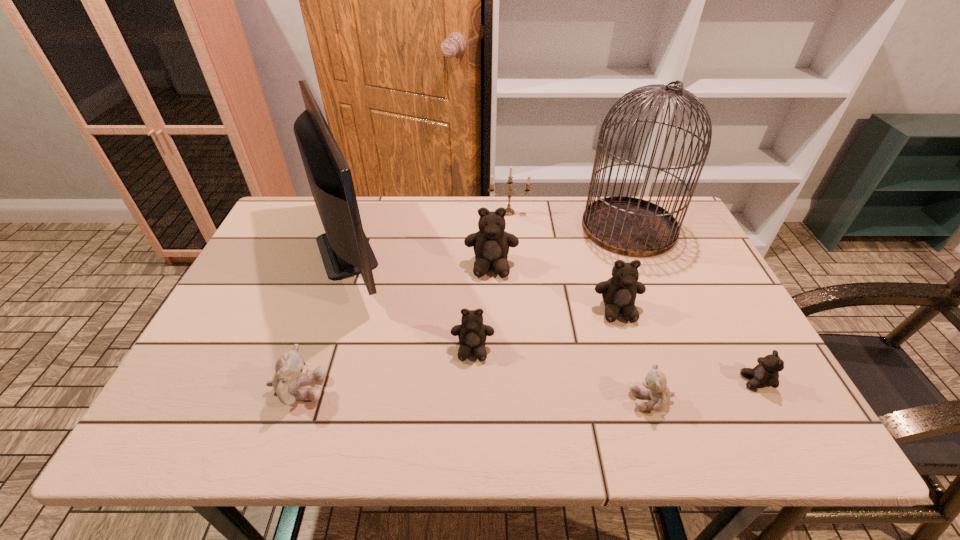
Where is `birdcage`? This screenshot has width=960, height=540. birdcage is located at coordinates (629, 226).

I want to click on computer monitor, so click(345, 250).

The image size is (960, 540). In order to click on the farthest brown teddy bear in this screenshot , I will do `click(491, 243)`.

You are a GUI agent. You are given a task and a screenshot of the screen. Output one action in this format:
    pyautogui.click(x=<x>, y=<y>)
    Task: Click on the tallest teddy bear
    
    Given the screenshot: What is the action you would take?
    pyautogui.click(x=491, y=243)

Image resolution: width=960 pixels, height=540 pixels. Identify the location of candle. (510, 211).

Image resolution: width=960 pixels, height=540 pixels. Identify the location of the second biggest brown teddy bear. click(619, 292).

At what (x,y) coordinates should I click in order to perform the action: click on the fifth shortest teddy bear. Please return your answer as a coordinate pair (x, y). Looking at the image, I should click on (619, 292).

This screenshot has width=960, height=540. I want to click on the third biggest brown teddy bear, so click(472, 333).

Find the location of a particular element. This screenshot has height=540, width=960. the sixth farthest object is located at coordinates (472, 333).

At what (x,y) coordinates should I click in order to perform the action: click on the left gray teddy bear. Please return your answer as a coordinate pair (x, y). The height and width of the screenshot is (540, 960). Looking at the image, I should click on (291, 372).